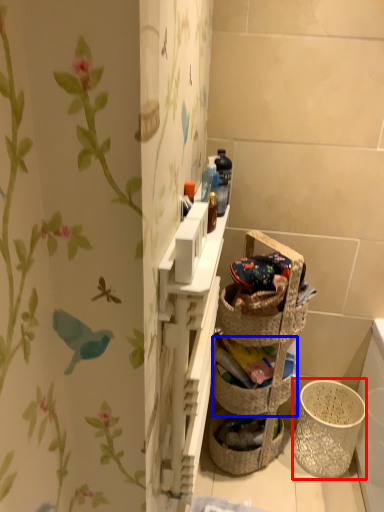
Question: Which object is closer to the camera taking this photo, basket container (highlighted by a red box) or basket container (highlighted by a blue box)?

Choices:
 (A) basket container
 (B) basket container

Answer: (B)